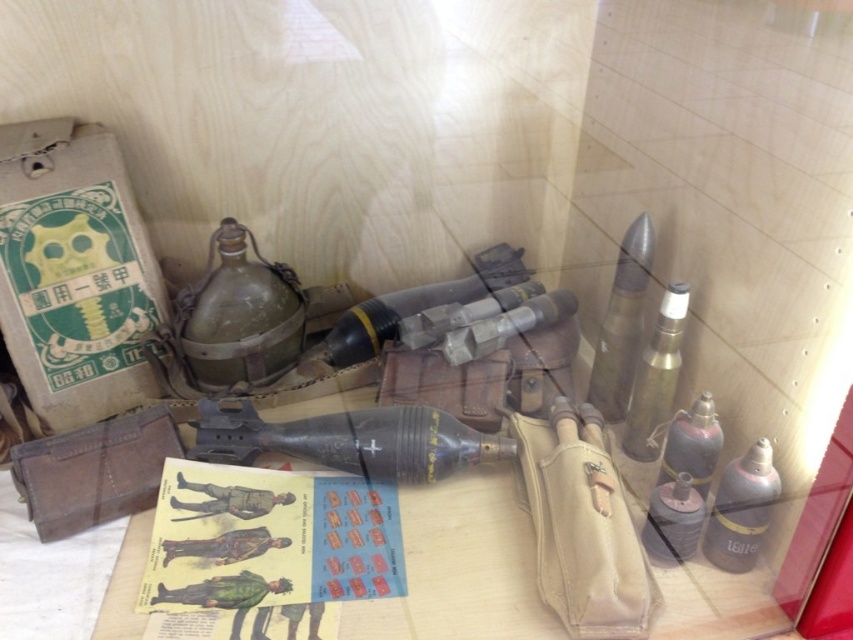
Question: Is matte black rocket at center below matte green bottle at lower right?

Choices:
 (A) yes
 (B) no

Answer: (B)

Question: Can you confirm if metallic silver bullet at upper right is bigger than matte green bottle at lower right?

Choices:
 (A) no
 (B) yes

Answer: (B)

Question: Which of the following is the farthest from the observer?

Choices:
 (A) metallic silver bullet at upper right
 (B) matte green bottle at lower right
 (C) metallic silver bottle at upper right
 (D) black rubber grenade at center

Answer: (A)

Question: Can you confirm if black rubber grenade at center is positioned to the right of metallic silver bullet at upper right?

Choices:
 (A) yes
 (B) no

Answer: (B)

Question: Which is nearer to the metallic silver bullet at upper right?

Choices:
 (A) matte green bottle at right
 (B) matte green bottle at lower right

Answer: (A)

Question: Considering the real-world distances, which object is closest to the matte green bottle at lower right?

Choices:
 (A) black rubber grenade at center
 (B) matte green bottle at right
 (C) metallic silver bottle at upper right
 (D) matte black bottle at lower right

Answer: (D)